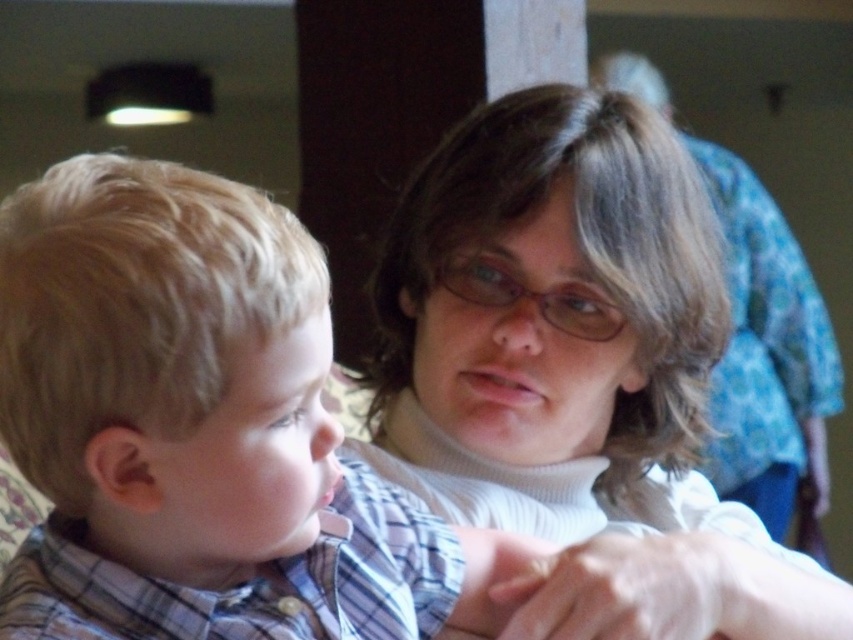
You are an architect designing a new building and need to determine which of the two points, point (28, 346) or point (485, 157), is closer to the entrance. Based on the image provided, which point is closer?

Point (28, 346) is closer to the viewer than point (485, 157), so it is closer to the entrance.

What is the exact coordinate of the plaid shirt at left?

The plaid shirt at left is located at point (x=198, y=426).

You are a photographer trying to capture a candid shot of both the plaid shirt at left and the white turtleneck sweater at center. Since you want to ensure both are fully visible in the frame, which clothing item should you focus on first to adjust your camera angle?

The plaid shirt at left has a lesser height compared to the white turtleneck sweater at center, so you should focus on adjusting the camera angle to ensure the plaid shirt at left is fully visible first.